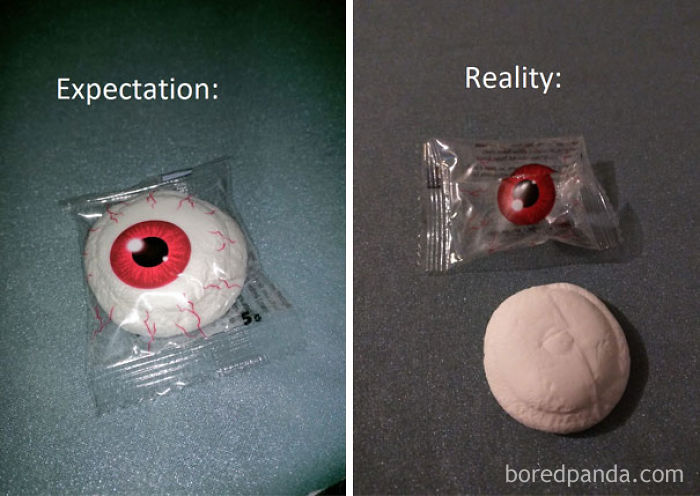
At what (x,y) coordinates should I click in order to perform the action: click on empty countertop. Please return your answer as a coordinate pair (x, y). The height and width of the screenshot is (496, 700). Looking at the image, I should click on (288, 391), (449, 301).